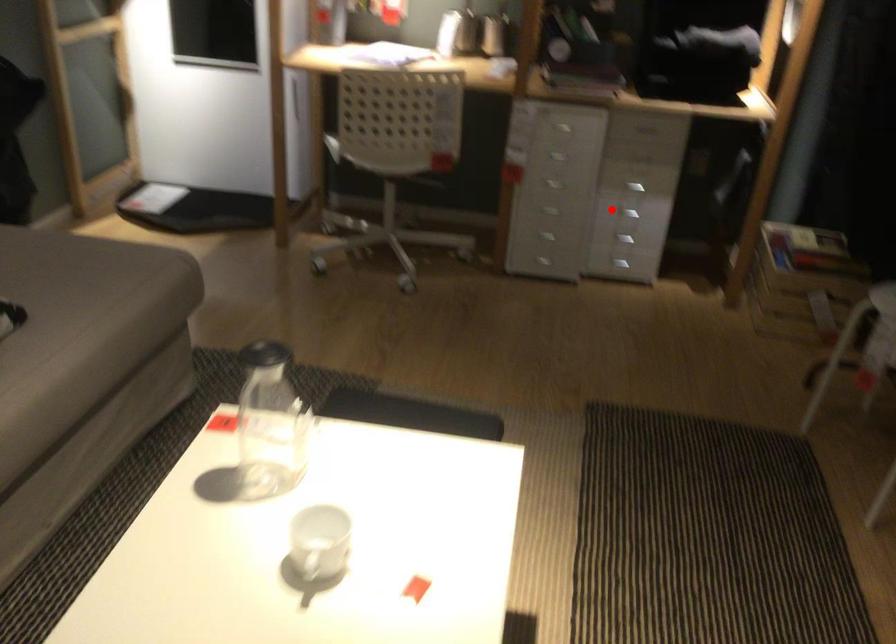
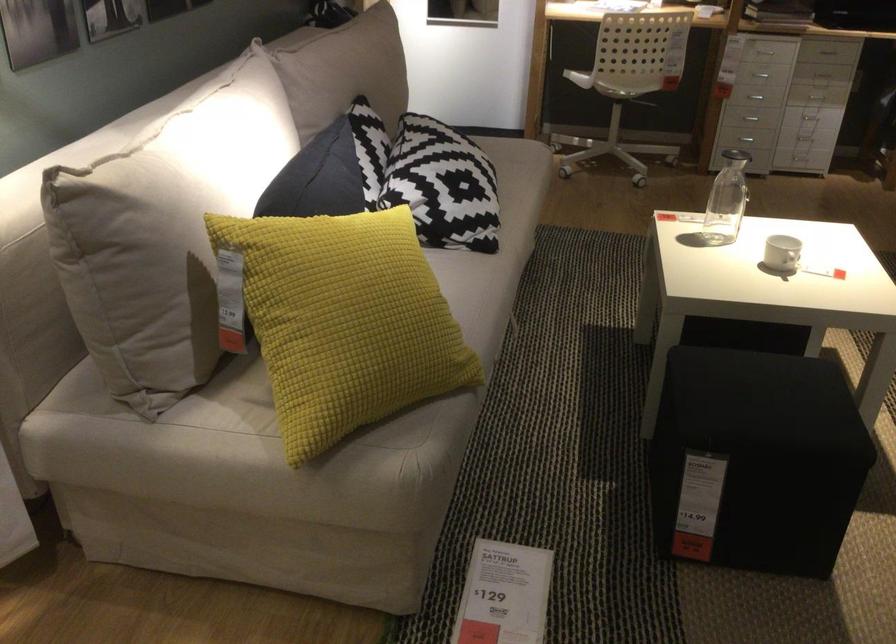
Question: A red point is marked in image1. In image2, is the corresponding 3D point closer to the camera or farther? Reply with the corresponding letter.

Choices:
 (A) The corresponding 3D point is closer.
 (B) The corresponding 3D point is farther.

Answer: (B)